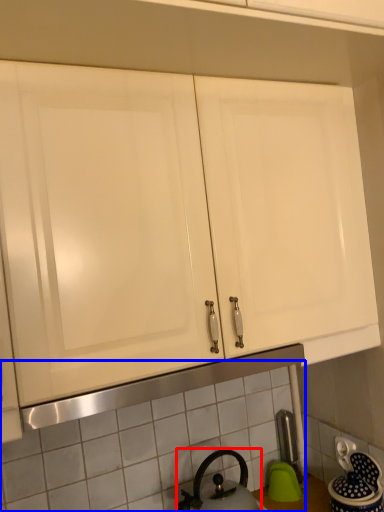
Question: Which object is closer to the camera taking this photo, kettle (highlighted by a red box) or tile (highlighted by a blue box)?

Choices:
 (A) kettle
 (B) tile

Answer: (A)